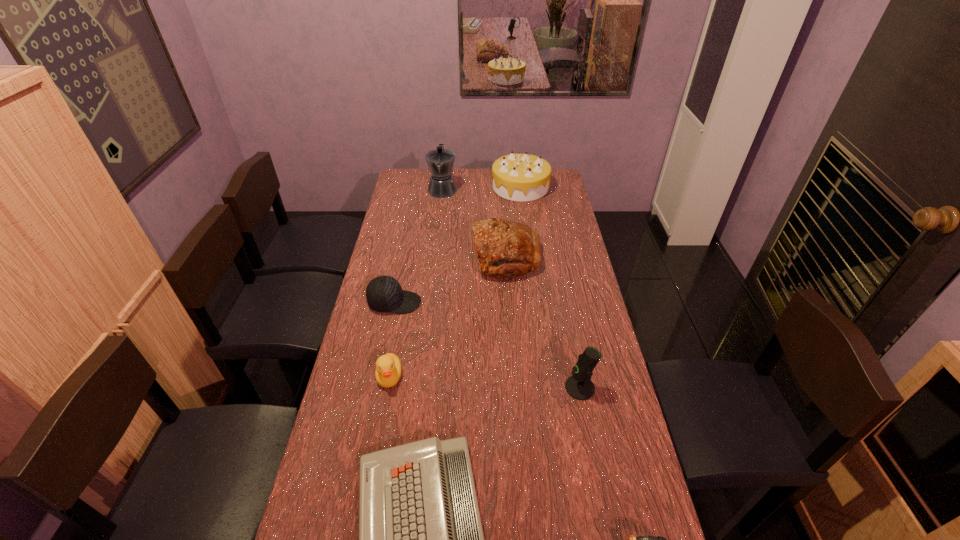
The width and height of the screenshot is (960, 540). In order to click on microphone present at the right edge in this screenshot , I will do `click(579, 386)`.

The width and height of the screenshot is (960, 540). I want to click on object that is at the far left corner, so click(440, 161).

This screenshot has height=540, width=960. Identify the location of object at the far right corner. (517, 177).

In the image, there is a desktop. Where is `vacant space at the far edge`? vacant space at the far edge is located at coordinates (481, 180).

Locate an element on the screen. blank space at the left edge is located at coordinates [373, 276].

The height and width of the screenshot is (540, 960). Find the location of `free space at the right edge of the desktop`. free space at the right edge of the desktop is located at coordinates (x=554, y=201).

Where is `vacant space that's between the microphone and the birthday cake`? The image size is (960, 540). vacant space that's between the microphone and the birthday cake is located at coordinates (550, 287).

The image size is (960, 540). Find the location of `free space between the coffeepot and the birthday cake`. free space between the coffeepot and the birthday cake is located at coordinates [481, 188].

I want to click on vacant space in between the bread and the baseball cap, so click(x=450, y=280).

Where is `vacant space in between the coffeepot and the birthday cake`? This screenshot has width=960, height=540. vacant space in between the coffeepot and the birthday cake is located at coordinates (481, 188).